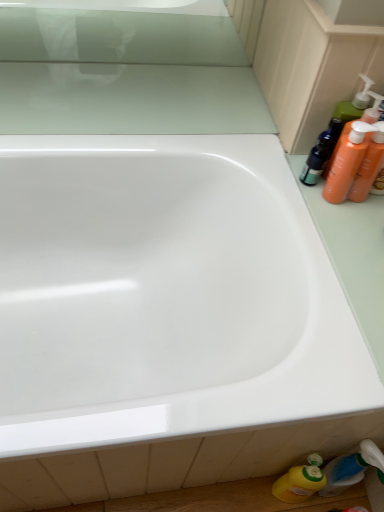
Locate an element on the screen. Image resolution: width=384 pixels, height=512 pixels. vacant area to the left of orange plastic bottles at upper right, marked as the second cleaning product in a left-to-right arrangement is located at coordinates (282, 176).